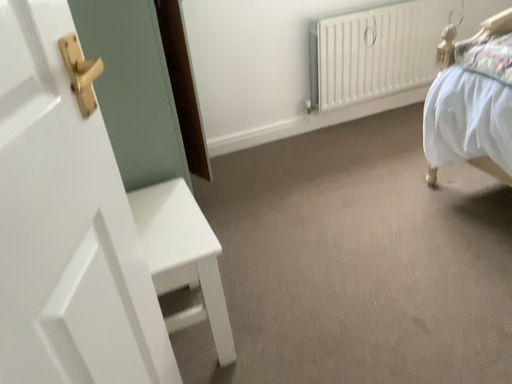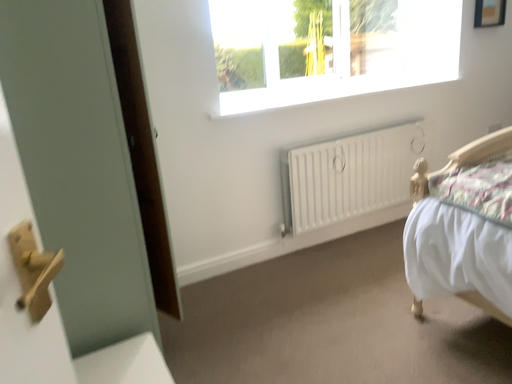
Question: How did the camera likely rotate when shooting the video?

Choices:
 (A) rotated downward
 (B) rotated upward

Answer: (B)